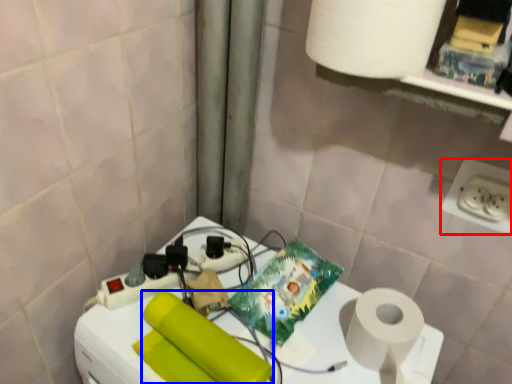
Question: Among these objects, which one is nearest to the camera, power plugs and sockets (highlighted by a red box) or toilet paper (highlighted by a blue box)?

Choices:
 (A) power plugs and sockets
 (B) toilet paper

Answer: (B)